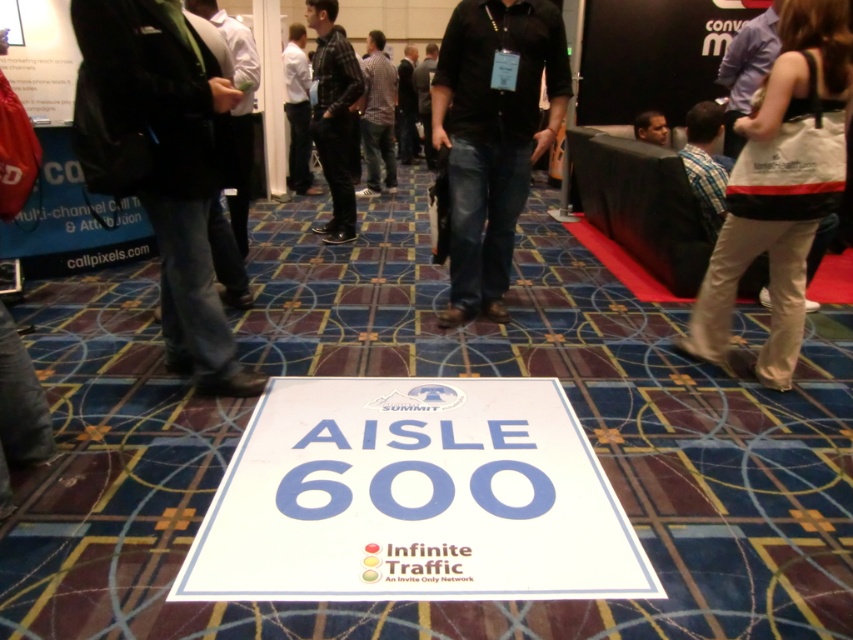
Which of these two, black denim jeans at center or plaid shirt at center, stands shorter?

With less height is black denim jeans at center.

This screenshot has width=853, height=640. What do you see at coordinates (492, 136) in the screenshot?
I see `black denim jeans at center` at bounding box center [492, 136].

The width and height of the screenshot is (853, 640). What do you see at coordinates (492, 136) in the screenshot?
I see `black denim jeans at center` at bounding box center [492, 136].

The width and height of the screenshot is (853, 640). Find the location of `black denim jeans at center`. black denim jeans at center is located at coordinates (492, 136).

Image resolution: width=853 pixels, height=640 pixels. What do you see at coordinates (780, 188) in the screenshot?
I see `white fabric bag at center-right` at bounding box center [780, 188].

You are a GUI agent. You are given a task and a screenshot of the screen. Output one action in this format:
    pyautogui.click(x=<x>, y=<y>)
    Task: Click on the white fabric bag at center-right
    
    Given the screenshot: What is the action you would take?
    pyautogui.click(x=780, y=188)

The width and height of the screenshot is (853, 640). In order to click on white fabric bag at center-right in this screenshot , I will do `click(780, 188)`.

The width and height of the screenshot is (853, 640). I want to click on white fabric bag at center-right, so click(x=780, y=188).

Looking at this image, which is below, black leather jacket at left or black denim jeans at center?

black leather jacket at left

Does black leather jacket at left appear on the left side of black denim jeans at center?

Correct, you'll find black leather jacket at left to the left of black denim jeans at center.

Where is `black leather jacket at left`? This screenshot has height=640, width=853. black leather jacket at left is located at coordinates (172, 166).